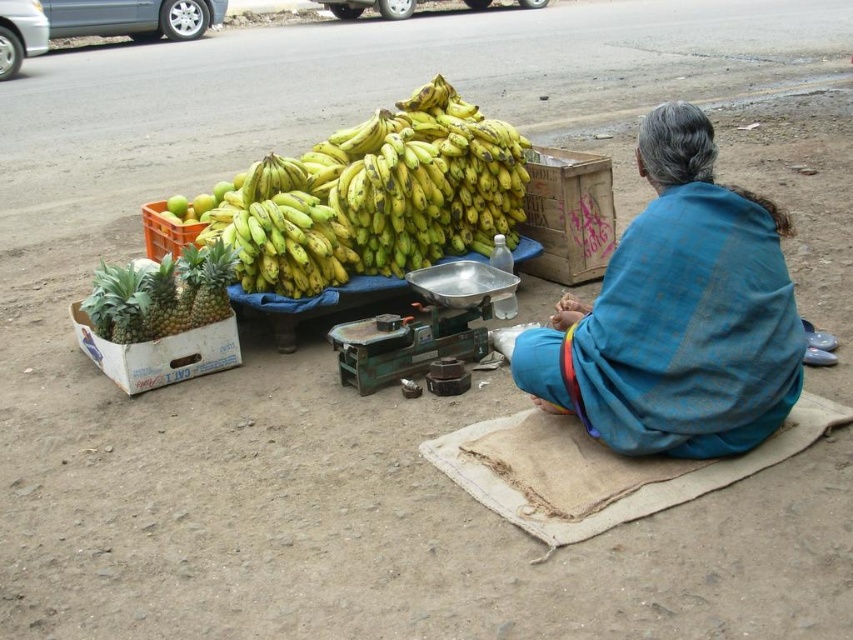
You are a customer at the fruit vendor and want to buy both the blue fabric shawl at center and the yellow matte bananas at center. Which item takes up more space on the vendor stall?

The yellow matte bananas at center takes up more space on the vendor stall because the blue fabric shawl at center is smaller than yellow matte bananas at center.

You are a customer at the fruit stall. You want to pick up the blue fabric shawl at center but need to reach it from above the yellow matte bananas at center. Is this possible?

The blue fabric shawl at center is located below the yellow matte bananas at center, so you can reach it by moving your hand downward from the bananas.